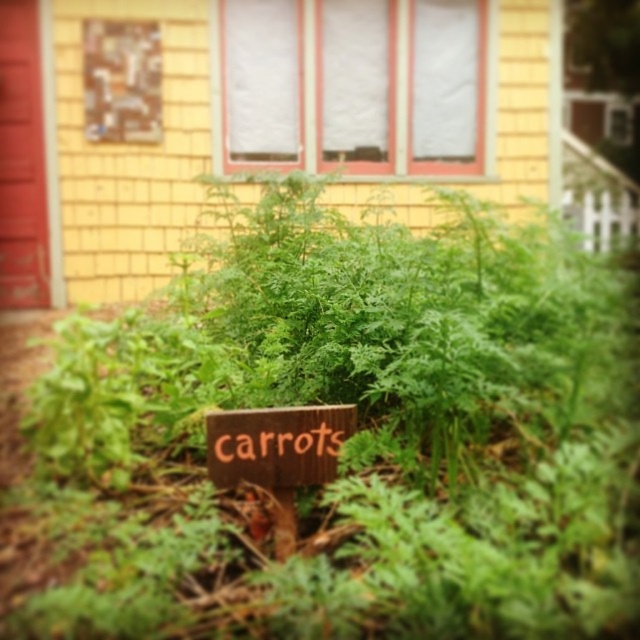
You are a gardener who wants to plant a new flower that needs sunlight. You see the green leafy plant at center and the wooden sign at center in the garden bed. Which object might block the sunlight to the new flower if placed between them?

The green leafy plant at center is much taller than the wooden sign at center, so it would block more sunlight. Therefore, placing the new flower between the green leafy plant at center and the wooden sign at center would result in the green leafy plant at center casting a shadow over the flower.